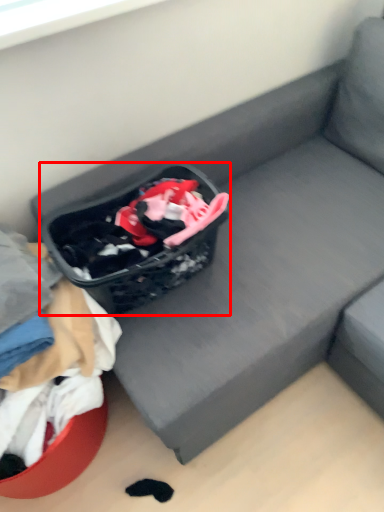
Question: From the image's perspective, what is the correct spatial positioning of shopping basket (annotated by the red box) in reference to clothing?

Choices:
 (A) above
 (B) below

Answer: (A)